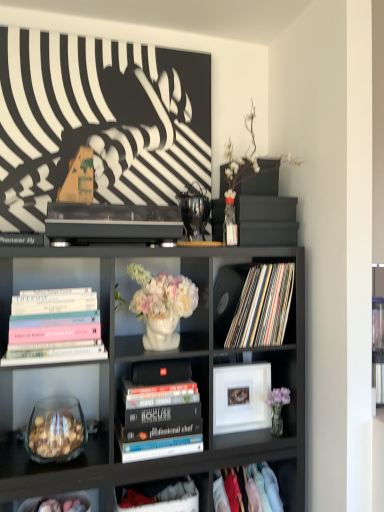
What do you see at coordinates (262, 307) in the screenshot? Image resolution: width=384 pixels, height=512 pixels. I see `matte vinyl records at center, which is the first book from top to bottom` at bounding box center [262, 307].

Describe the element at coordinates (161, 372) in the screenshot. I see `black matte speaker at center` at that location.

Locate an element on the screen. This screenshot has height=512, width=384. cloth at lower right, marked as the 2th shelf in a left-to-right arrangement is located at coordinates (287, 481).

What do you see at coordinates (168, 312) in the screenshot? I see `white glossy vase at center, which is the 2th shelf from right to left` at bounding box center [168, 312].

Where is `matte white picture frame at center`? This screenshot has width=384, height=512. matte white picture frame at center is located at coordinates (241, 397).

The height and width of the screenshot is (512, 384). Identify the location of hardcover books at center, which ranks as the third book in top-to-bottom order. (158, 420).

Which object is further away from the camera taking this photo, cloth at lower right, which appears as the first shelf when viewed from the right, or matte black bookcase at center?

Positioned behind is cloth at lower right, which appears as the first shelf when viewed from the right.

From a real-world perspective, is cloth at lower right, marked as the 2th shelf in a left-to-right arrangement, physically above matte black bookcase at center?

Result: No, from a real-world perspective, cloth at lower right, marked as the 2th shelf in a left-to-right arrangement, is not above matte black bookcase at center.

Considering the sizes of objects cloth at lower right, marked as the 2th shelf in a left-to-right arrangement, and matte black bookcase at center in the image provided, who is taller, cloth at lower right, marked as the 2th shelf in a left-to-right arrangement, or matte black bookcase at center?

Standing taller between the two is matte black bookcase at center.

Identify the location of bookcase lying above the cloth at lower right, which appears as the first shelf when viewed from the right (from the image's perspective). (147, 360).

Which object is thinner, pink glass vase at lower right or cloth at lower right, marked as the 2th shelf in a left-to-right arrangement?

With smaller width is pink glass vase at lower right.

From a real-world perspective, between pink glass vase at lower right and cloth at lower right, which appears as the first shelf when viewed from the right, who is vertically lower?

From a 3D spatial view, cloth at lower right, which appears as the first shelf when viewed from the right, is below.

Is pink glass vase at lower right inside or outside of cloth at lower right, the second shelf positioned from the top?

pink glass vase at lower right is outside cloth at lower right, the second shelf positioned from the top.

From the picture: Is pink glass vase at lower right facing away from cloth at lower right, which appears as the first shelf when viewed from the right?

No.

Would you say pastel hardcover books at left, the third book when ordered from right to left, is to the left or to the right of pink glass vase at lower right in the picture?

pastel hardcover books at left, the third book when ordered from right to left, is positioned on pink glass vase at lower right's left side.

Considering the sizes of pastel hardcover books at left, which appears as the first book when viewed from the left, and pink glass vase at lower right in the image, is pastel hardcover books at left, which appears as the first book when viewed from the left, taller or shorter than pink glass vase at lower right?

pastel hardcover books at left, which appears as the first book when viewed from the left, is taller than pink glass vase at lower right.

Is pastel hardcover books at left, the third book when ordered from right to left, wider than pink glass vase at lower right?

Yes.

Does pastel hardcover books at left, which appears as the first book when viewed from the left, lie behind white glossy vase at center, positioned as the 1th shelf in top-to-bottom order?

No, pastel hardcover books at left, which appears as the first book when viewed from the left, is closer to the viewer.

From a real-world perspective, is pastel hardcover books at left, the third book when ordered from right to left, positioned above or below white glossy vase at center, which is the 2th shelf from right to left?

Clearly, from a real-world perspective, pastel hardcover books at left, the third book when ordered from right to left, is below white glossy vase at center, which is the 2th shelf from right to left.

Considering the sizes of objects cloth at lower right, which appears as the first shelf when viewed from the right, and translucent glass bowl at lower left in the image provided, who is shorter, cloth at lower right, which appears as the first shelf when viewed from the right, or translucent glass bowl at lower left?

With less height is translucent glass bowl at lower left.

From the image's perspective, is cloth at lower right, which appears as the first shelf when viewed from the right, located above or below translucent glass bowl at lower left?

Based on their image positions, cloth at lower right, which appears as the first shelf when viewed from the right, is located beneath translucent glass bowl at lower left.

Locate an element on the screen. food located above the cloth at lower right, marked as the 2th shelf in a left-to-right arrangement (from the image's perspective) is located at coordinates (55, 433).

From a real-world perspective, is matte white picture frame at center under cloth at lower right, which appears as the first shelf when viewed from the right?

No, from a real-world perspective, matte white picture frame at center is not under cloth at lower right, which appears as the first shelf when viewed from the right.

Is matte white picture frame at center far away from cloth at lower right, the second shelf positioned from the top?

Actually, matte white picture frame at center and cloth at lower right, the second shelf positioned from the top, are a little close together.

Which is behind, point (245, 408) or point (272, 463)?

The point (245, 408) is farther from the camera.

Which is less distant, (148, 372) or (294, 476)?

Point (148, 372).

Is black matte speaker at center oriented away from cloth at lower right, the second shelf positioned from the top?

That's not correct — black matte speaker at center is not looking away from cloth at lower right, the second shelf positioned from the top.

Locate an element on the screen. The image size is (384, 512). paperback book behind the cloth at lower right, marked as the first shelf in a bottom-to-top arrangement is located at coordinates (161, 372).

Is black matte speaker at center completely or partially outside of cloth at lower right, which appears as the first shelf when viewed from the right?

black matte speaker at center lies outside cloth at lower right, which appears as the first shelf when viewed from the right,'s area.

Find the location of `bookcase in front of the cloth at lower right, marked as the 2th shelf in a left-to-right arrangement`. bookcase in front of the cloth at lower right, marked as the 2th shelf in a left-to-right arrangement is located at coordinates [147, 360].

You are a GUI agent. You are given a task and a screenshot of the screen. Output one action in this format:
    pyautogui.click(x=<x>, y=<y>)
    Task: Click on the shelf directly beneath the pink glass vase at lower right (from a real-world perspective)
    
    Given the screenshot: What is the action you would take?
    pyautogui.click(x=287, y=481)

From the image, which object appears to be nearer to white glossy vase at center, positioned as the 1th shelf in top-to-bottom order, pink glass vase at lower right or matte black bookcase at center?

matte black bookcase at center lies closer to white glossy vase at center, positioned as the 1th shelf in top-to-bottom order, than the other object.

Considering their positions, is white glossy vase at center, positioned as the 1th shelf in top-to-bottom order, positioned further to matte vinyl records at center, placed as the 1th book when sorted from right to left, than matte white picture frame at center?

Among the two, matte white picture frame at center is located further to matte vinyl records at center, placed as the 1th book when sorted from right to left.

Based on their spatial positions, is pastel hardcover books at left, the third book when ordered from right to left, or cloth at lower right, the second shelf positioned from the top, closer to pink glass vase at lower right?

cloth at lower right, the second shelf positioned from the top, is closer to pink glass vase at lower right.

Considering their positions, is matte white picture frame at center positioned further to white glossy vase at center, which is the 2th shelf from right to left, than matte vinyl records at center, which is the first book from top to bottom?

matte white picture frame at center lies further to white glossy vase at center, which is the 2th shelf from right to left, than the other object.

Based on their spatial positions, is cloth at lower right, the second shelf positioned from the top, or translucent glass bowl at lower left further from matte vinyl records at center, which is the first book from top to bottom?

Based on the image, translucent glass bowl at lower left appears to be further to matte vinyl records at center, which is the first book from top to bottom.

Looking at the image, which one is located closer to translucent glass bowl at lower left, black matte speaker at center or pastel hardcover books at left, which appears as the first book when viewed from the left?

black matte speaker at center lies closer to translucent glass bowl at lower left than the other object.

Which object lies further to the anchor point pink glass vase at lower right, cloth at lower right, marked as the 2th shelf in a left-to-right arrangement, or translucent glass bowl at lower left?

translucent glass bowl at lower left is positioned further to the anchor pink glass vase at lower right.

Based on their spatial positions, is translucent glass bowl at lower left or cloth at lower right, marked as the 2th shelf in a left-to-right arrangement, further from matte vinyl records at center, which is the first book from top to bottom?

translucent glass bowl at lower left is positioned further to the anchor matte vinyl records at center, which is the first book from top to bottom.

This screenshot has width=384, height=512. In order to click on bookcase between pastel hardcover books at left, the second book from the bottom, and cloth at lower right, marked as the 2th shelf in a left-to-right arrangement, from top to bottom in this screenshot , I will do `click(147, 360)`.

Find the location of a particular element. The width and height of the screenshot is (384, 512). book between pastel hardcover books at left, the second book from the bottom, and matte white picture frame at center from left to right is located at coordinates (158, 420).

Find the location of a particular element. The image size is (384, 512). paperback book between translucent glass bowl at lower left and cloth at lower right, the second shelf positioned from the top, in the horizontal direction is located at coordinates (161, 372).

At what (x,y) coordinates should I click in order to perform the action: click on picture frame located between pastel hardcover books at left, the 2th book when ordered from top to bottom, and matte vinyl records at center, the third book from the bottom, in the left-right direction. Please return your answer as a coordinate pair (x, y). The width and height of the screenshot is (384, 512). Looking at the image, I should click on (241, 397).